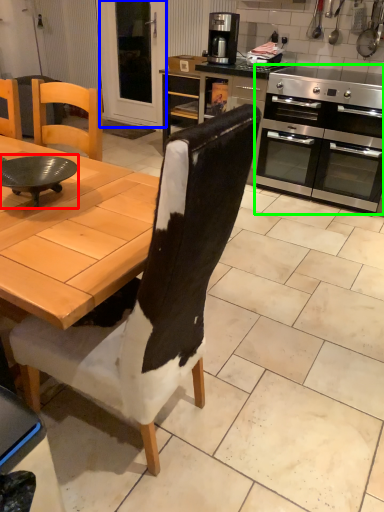
Question: Which object is the farthest from round table (highlighted by a red box)? Choose among these: screen door (highlighted by a blue box) or kitchen appliance (highlighted by a green box).

Choices:
 (A) screen door
 (B) kitchen appliance

Answer: (A)